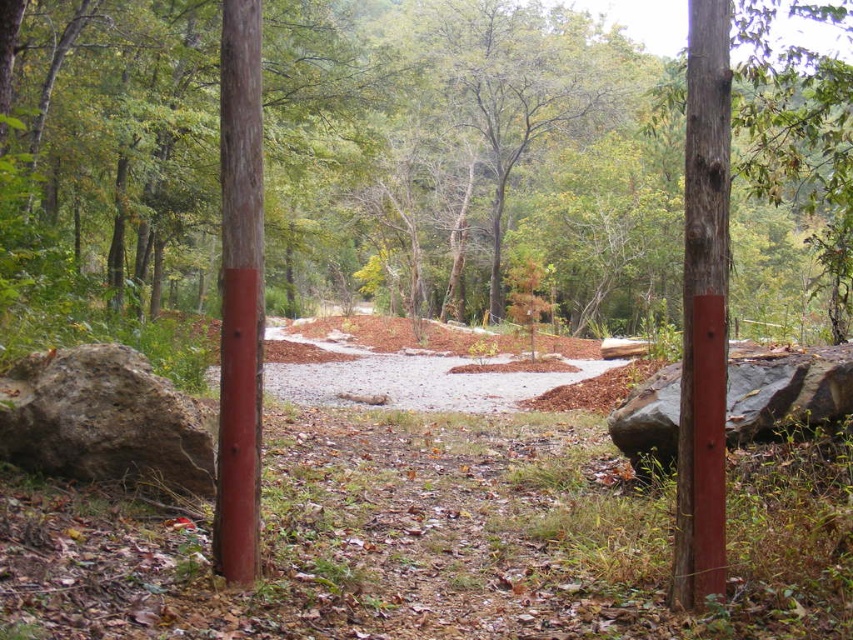
Who is lower down, smooth bark tree at center or wooden post at center?

wooden post at center is below.

Who is taller, smooth bark tree at center or wooden post at center?

smooth bark tree at center

Between point (575, 173) and point (689, 8), which one is positioned in front?

Point (689, 8)

I want to click on smooth bark tree at center, so click(469, 157).

Is wooden post at center positioned behind gray rough rock at lower left?

No, wooden post at center is in front of gray rough rock at lower left.

This screenshot has width=853, height=640. Describe the element at coordinates (703, 307) in the screenshot. I see `wooden post at center` at that location.

Identify the location of wooden post at center. The image size is (853, 640). (703, 307).

Which is behind, point (457, 173) or point (753, 394)?

The point (457, 173) is more distant.

The height and width of the screenshot is (640, 853). What do you see at coordinates (469, 157) in the screenshot?
I see `smooth bark tree at center` at bounding box center [469, 157].

This screenshot has width=853, height=640. I want to click on smooth bark tree at center, so click(469, 157).